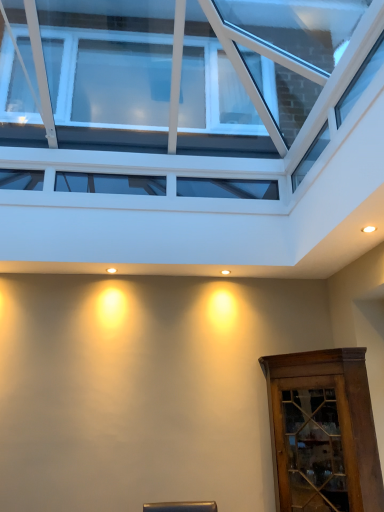
Describe the element at coordinates (201, 74) in the screenshot. Image resolution: width=384 pixels, height=512 pixels. I see `transparent glass window at upper center` at that location.

This screenshot has height=512, width=384. Find the location of `transparent glass window at upper center`. transparent glass window at upper center is located at coordinates (201, 74).

The width and height of the screenshot is (384, 512). I want to click on brown wooden cabinet at lower right, so click(x=323, y=432).

Describe the element at coordinates (323, 432) in the screenshot. I see `brown wooden cabinet at lower right` at that location.

Find the location of a particular element. transparent glass window at upper center is located at coordinates pyautogui.click(x=201, y=74).

Looking at this image, considering the positions of objects brown wooden cabinet at lower right and transparent glass window at upper center in the image provided, who is more to the right, brown wooden cabinet at lower right or transparent glass window at upper center?

brown wooden cabinet at lower right is more to the right.

Considering their positions, is brown wooden cabinet at lower right located in front of or behind transparent glass window at upper center?

Visually, brown wooden cabinet at lower right is located behind transparent glass window at upper center.

Is point (346, 493) less distant than point (70, 136)?

Yes.

From the image's perspective, is brown wooden cabinet at lower right positioned above or below transparent glass window at upper center?

Clearly, from the image's perspective, brown wooden cabinet at lower right is below transparent glass window at upper center.

From a real-world perspective, is brown wooden cabinet at lower right physically above transparent glass window at upper center?

Actually, brown wooden cabinet at lower right is physically below transparent glass window at upper center in the real world.

Considering the sizes of objects brown wooden cabinet at lower right and transparent glass window at upper center in the image provided, who is wider, brown wooden cabinet at lower right or transparent glass window at upper center?

transparent glass window at upper center.

Considering the relative sizes of brown wooden cabinet at lower right and transparent glass window at upper center in the image provided, is brown wooden cabinet at lower right taller than transparent glass window at upper center?

In fact, brown wooden cabinet at lower right may be shorter than transparent glass window at upper center.

Is brown wooden cabinet at lower right smaller than transparent glass window at upper center?

Correct, brown wooden cabinet at lower right occupies less space than transparent glass window at upper center.

Do you think brown wooden cabinet at lower right is within transparent glass window at upper center, or outside of it?

brown wooden cabinet at lower right is not inside transparent glass window at upper center, it's outside.

Can you see brown wooden cabinet at lower right touching transparent glass window at upper center?

No, brown wooden cabinet at lower right is not next to transparent glass window at upper center.

Is brown wooden cabinet at lower right facing towards transparent glass window at upper center?

No, brown wooden cabinet at lower right is not facing towards transparent glass window at upper center.

Locate an element on the screen. Image resolution: width=384 pixels, height=512 pixels. window in front of the brown wooden cabinet at lower right is located at coordinates (201, 74).

In the scene shown: Which is more to the left, transparent glass window at upper center or brown wooden cabinet at lower right?

transparent glass window at upper center is more to the left.

Which object is further away from the camera taking this photo, transparent glass window at upper center or brown wooden cabinet at lower right?

brown wooden cabinet at lower right.

Does point (253, 32) come farther from viewer compared to point (370, 480)?

Yes, it is behind point (370, 480).

From the picture: From the image's perspective, is transparent glass window at upper center below brown wooden cabinet at lower right?

Actually, transparent glass window at upper center appears above brown wooden cabinet at lower right in the image.

From a real-world perspective, is transparent glass window at upper center physically above brown wooden cabinet at lower right?

Yes.

Can you confirm if transparent glass window at upper center is wider than brown wooden cabinet at lower right?

Indeed, transparent glass window at upper center has a greater width compared to brown wooden cabinet at lower right.

Which of these two, transparent glass window at upper center or brown wooden cabinet at lower right, stands taller?

transparent glass window at upper center.

Which of these two, transparent glass window at upper center or brown wooden cabinet at lower right, is bigger?

transparent glass window at upper center.

Can we say transparent glass window at upper center lies outside brown wooden cabinet at lower right?

Indeed, transparent glass window at upper center is completely outside brown wooden cabinet at lower right.

Is transparent glass window at upper center next to brown wooden cabinet at lower right and touching it?

No, transparent glass window at upper center is not next to brown wooden cabinet at lower right.

Does transparent glass window at upper center turn towards brown wooden cabinet at lower right?

No, transparent glass window at upper center is not oriented towards brown wooden cabinet at lower right.

What's the angular difference between transparent glass window at upper center and brown wooden cabinet at lower right's facing directions?

89.2 degrees separate the facing orientations of transparent glass window at upper center and brown wooden cabinet at lower right.

Identify the location of window in front of the brown wooden cabinet at lower right. (201, 74).

Locate an element on the screen. The height and width of the screenshot is (512, 384). window that appears above the brown wooden cabinet at lower right (from the image's perspective) is located at coordinates (201, 74).

In order to click on window on the left side of brown wooden cabinet at lower right in this screenshot , I will do `click(201, 74)`.